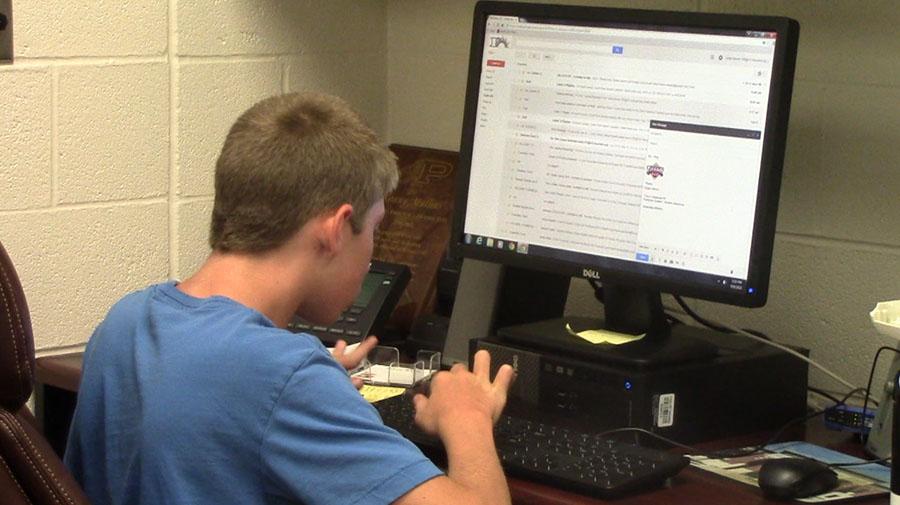
Where is `computer tower`? computer tower is located at coordinates (614, 382).